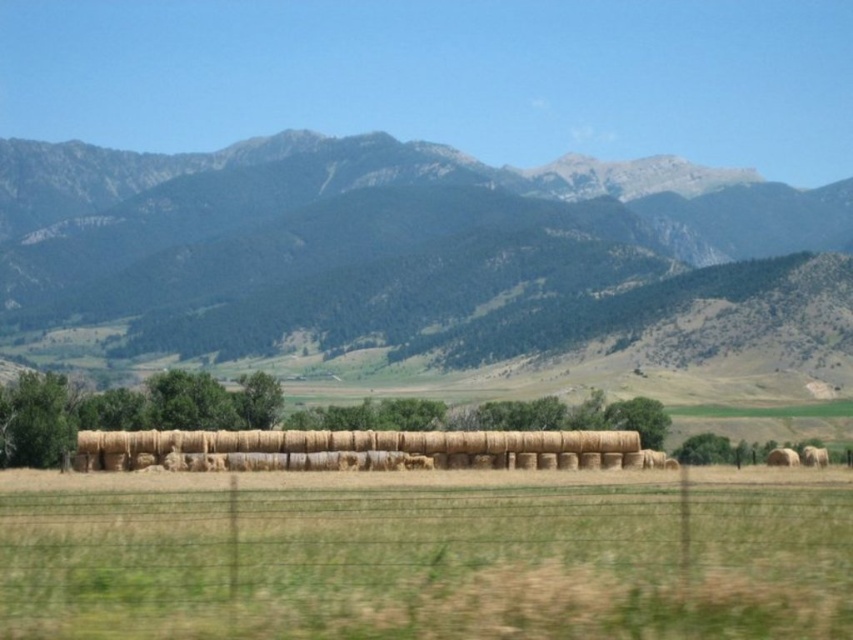
You are standing at the center of the field with rows of hay bales. You see a point marked at coordinate (416, 262). What is the location of this point relative to the green textured mountain range at upper center?

The point at (416, 262) marks the green textured mountain range at upper center, so it is located exactly at that coordinate.

You are a farmer planning to transport the brown straw bales at center and golden straw bales at center using a truck that can carry items up to 2 meters in width. Which of the two straw bales can fit through the truck without needing to be repositioned?

The golden straw bales at center can fit through the truck since their width is smaller than the brown straw bales at center, and the truck can accommodate items up to 2 meters in width.

You are standing in the middle of the field and see the green textured mountain range at upper center. If you want to take a photo that includes both the hay bales and the mountain range in the background, will the mountain range be in focus if your camera has a depth of field that can cover 100 meters?

The green textured mountain range at upper center is 101.25 meters away from the camera. Since the camera can only cover 100 meters depth of field, the mountain range will be slightly out of focus.